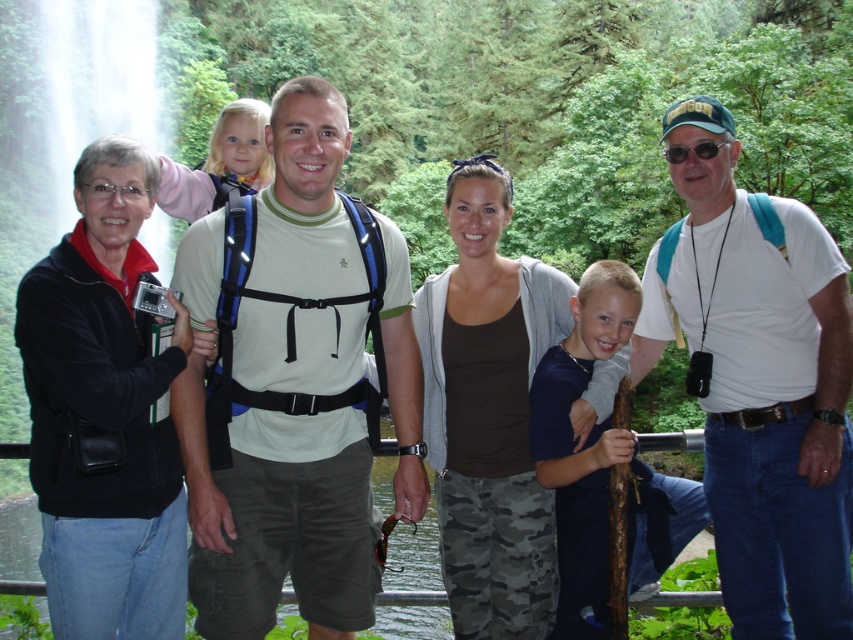
Question: Which of these objects is positioned farthest from the white cotton t-shirt at center?

Choices:
 (A) matte white t-shirt at center
 (B) black leather jacket at left

Answer: (B)

Question: Is white cotton t-shirt at center to the right of black leather jacket at left from the viewer's perspective?

Choices:
 (A) yes
 (B) no

Answer: (A)

Question: Considering the relative positions of matte white t-shirt at center and white cotton t-shirt at center in the image provided, where is matte white t-shirt at center located with respect to white cotton t-shirt at center?

Choices:
 (A) above
 (B) below

Answer: (B)

Question: Which of the following is the farthest from the observer?

Choices:
 (A) (781, 268)
 (B) (93, 596)

Answer: (A)

Question: Does white cotton t-shirt at center appear on the right side of black leather jacket at left?

Choices:
 (A) no
 (B) yes

Answer: (B)

Question: Among these points, which one is farthest from the camera?

Choices:
 (A) (119, 150)
 (B) (416, 356)

Answer: (B)